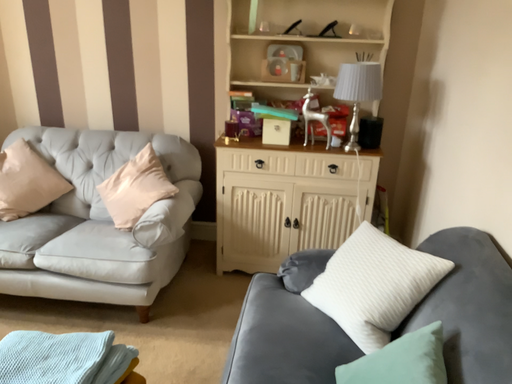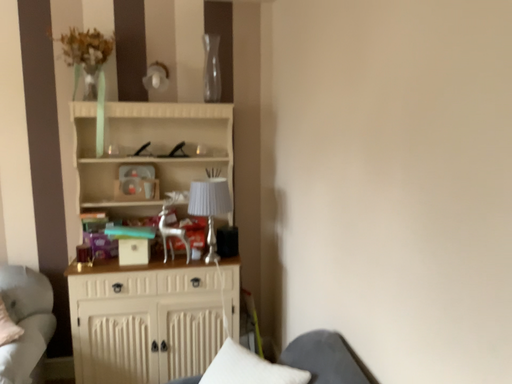
Question: Which way did the camera rotate in the video?

Choices:
 (A) rotated left
 (B) rotated right

Answer: (B)